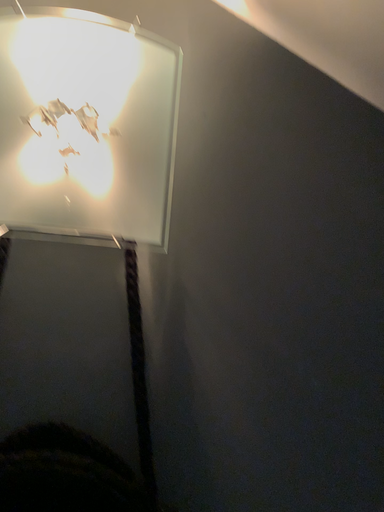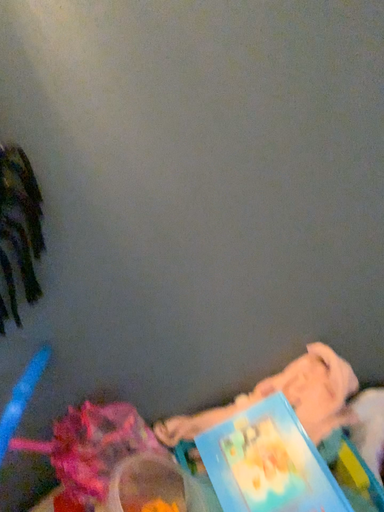
Question: Which way did the camera rotate in the video?

Choices:
 (A) rotated upward
 (B) rotated downward

Answer: (B)